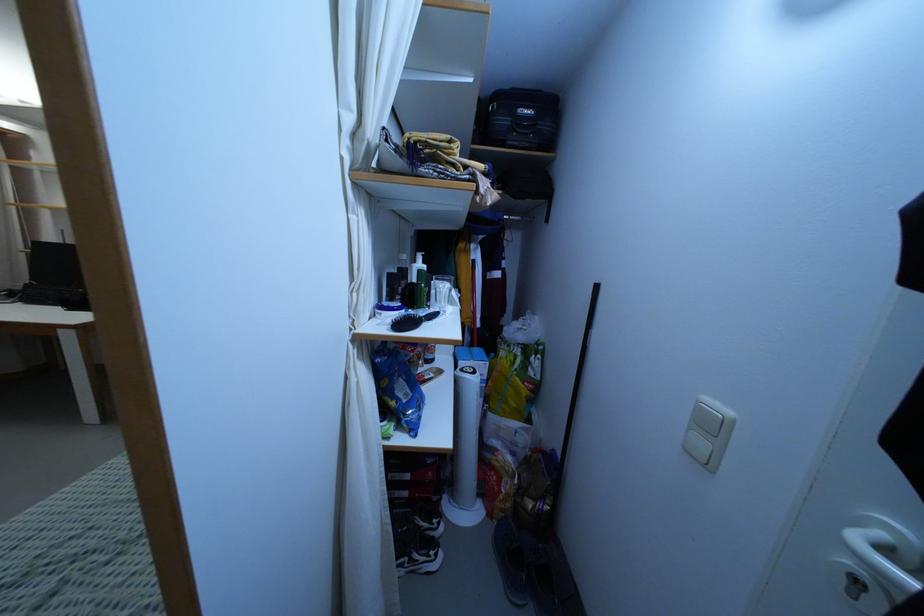
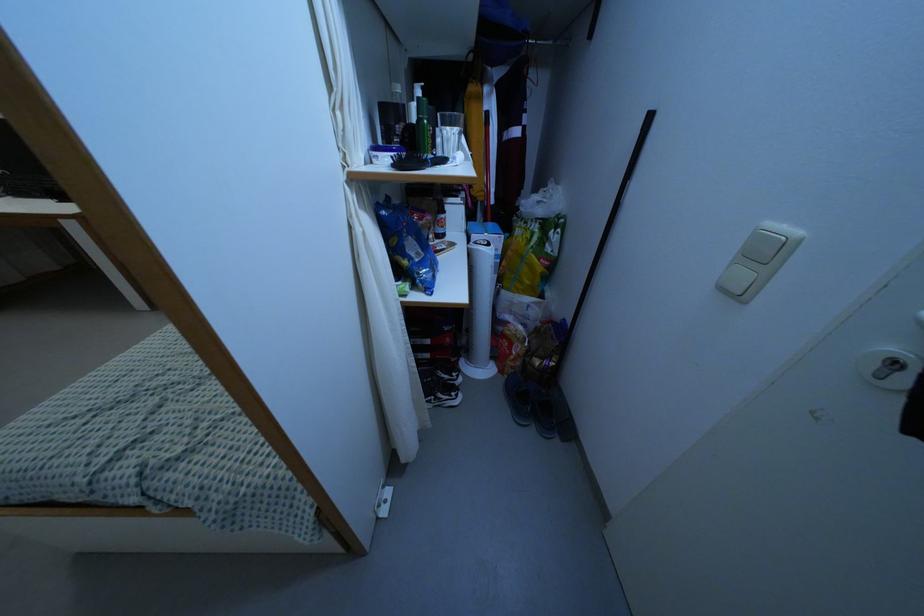
The point at (432, 291) is marked in the first image. Where is the corresponding point in the second image?

(438, 140)